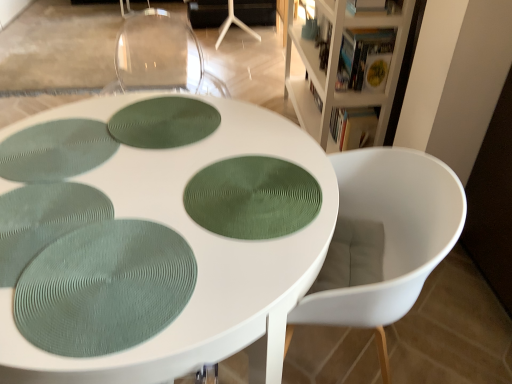
At what (x,y) coordinates should I click in order to perform the action: click on free space below green textured placemat at lower left, the 3th oval positioned from the top (from a real-world perspective). Please return your answer as a coordinate pair (x, y). The image size is (512, 384). Looking at the image, I should click on (111, 282).